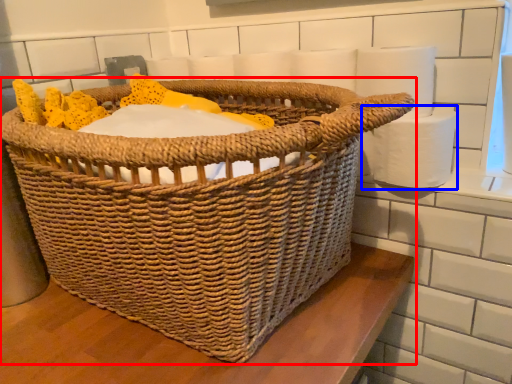
Question: Among these objects, which one is farthest to the camera, picnic basket (highlighted by a red box) or toilet paper (highlighted by a blue box)?

Choices:
 (A) picnic basket
 (B) toilet paper

Answer: (B)